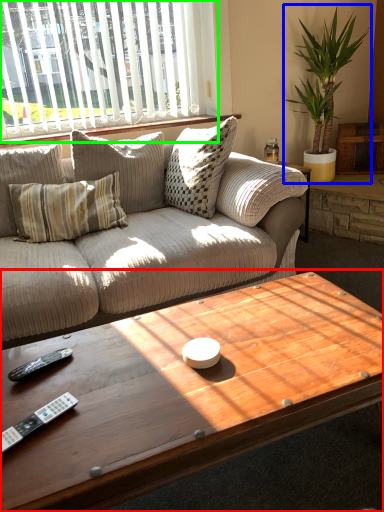
Question: Which is nearer to the coffee table (highlighted by a red box)? houseplant (highlighted by a blue box) or window (highlighted by a green box).

Choices:
 (A) houseplant
 (B) window

Answer: (B)